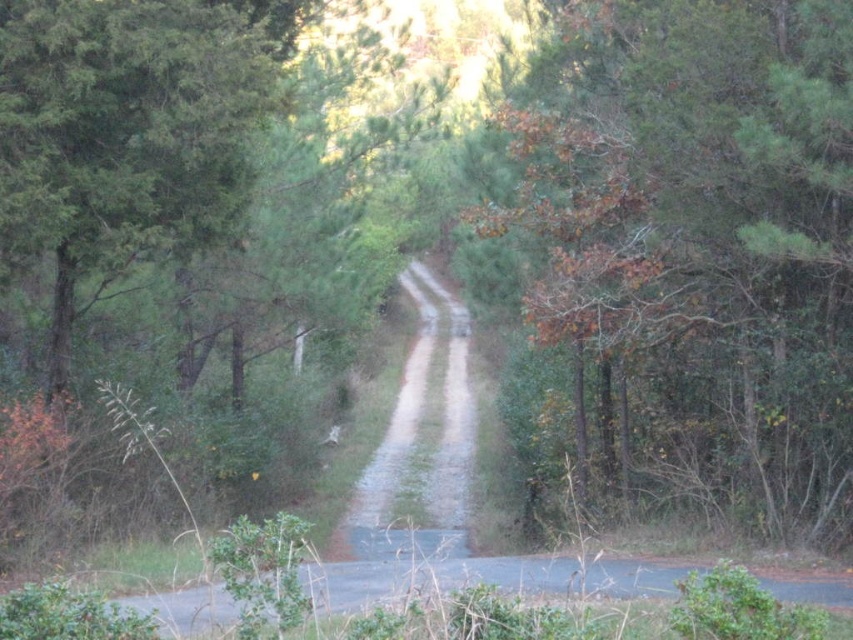
Which of these two, brown/dry leaves at upper center or dirt/gravel trail at center, stands shorter?

brown/dry leaves at upper center is shorter.

You are a GUI agent. You are given a task and a screenshot of the screen. Output one action in this format:
    pyautogui.click(x=<x>, y=<y>)
    Task: Click on the brown/dry leaves at upper center
    Image resolution: width=853 pixels, height=640 pixels.
    Given the screenshot: What is the action you would take?
    pyautogui.click(x=697, y=244)

Is point (781, 422) behind point (416, 467)?

No, it is not.

This screenshot has width=853, height=640. Identify the location of brown/dry leaves at upper center. (697, 244).